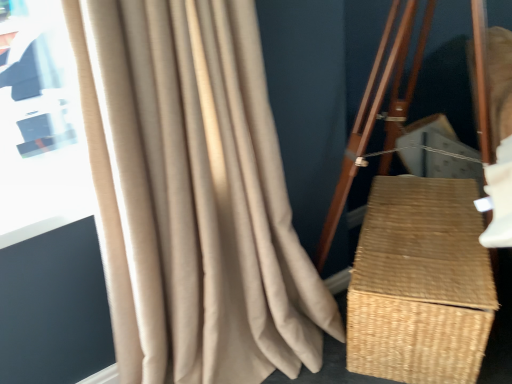
Question: Relative to woven natural basket at right, is beige textured curtain at left in front or behind?

Choices:
 (A) behind
 (B) front

Answer: (B)

Question: From a real-world perspective, is beige textured curtain at left above or below woven natural basket at right?

Choices:
 (A) below
 (B) above

Answer: (B)

Question: Looking at their shapes, would you say beige textured curtain at left is wider or thinner than woven natural basket at right?

Choices:
 (A) wide
 (B) thin

Answer: (B)

Question: In terms of width, does woven natural basket at right look wider or thinner when compared to beige textured curtain at left?

Choices:
 (A) wide
 (B) thin

Answer: (A)

Question: In terms of size, does woven natural basket at right appear bigger or smaller than beige textured curtain at left?

Choices:
 (A) big
 (B) small

Answer: (B)

Question: Relative to beige textured curtain at left, is woven natural basket at right in front or behind?

Choices:
 (A) behind
 (B) front

Answer: (A)

Question: Considering the relative positions of woven natural basket at right and beige textured curtain at left in the image provided, is woven natural basket at right to the left or to the right of beige textured curtain at left?

Choices:
 (A) right
 (B) left

Answer: (A)